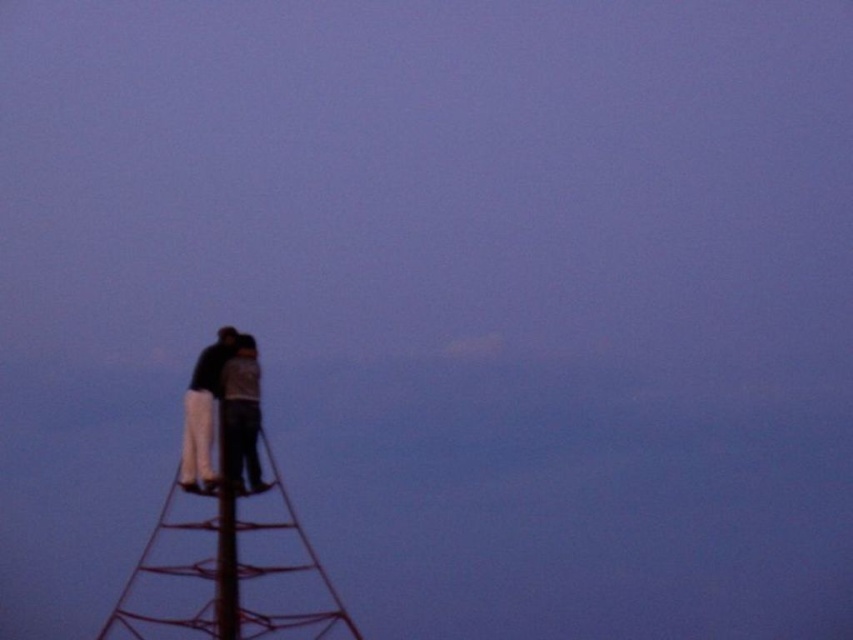
You are a drone operator trying to capture a photo of the metallic red ladder at upper left. The drone has a maximum range of 200 meters. Can the drone reach the ladder?

The distance between the metallic red ladder at upper left and the camera is 189.61 meters, which is within the drone operator drone maximum range of 200 meters. Yes, the drone can reach the ladder.

You are standing at the base of the structure and want to climb up to the top. Which ladder should you take first, the metallic red ladder at upper left or the metallic red ladder at left?

You should take the metallic red ladder at left first because the metallic red ladder at upper left is in front of it, meaning the ladder at left is behind and likely part of the lower section that you need to climb first to reach the upper one.

You are standing at the base of the red metal tower and want to reach the point marked as point (199,362). If your maximum reach is 200 meters, can you safely extend your arm to touch that point?

The distance between point (199,362) and the camera is 193.23 meters, which is within your maximum reach of 200 meters. Therefore, you can safely extend your arm to touch that point.